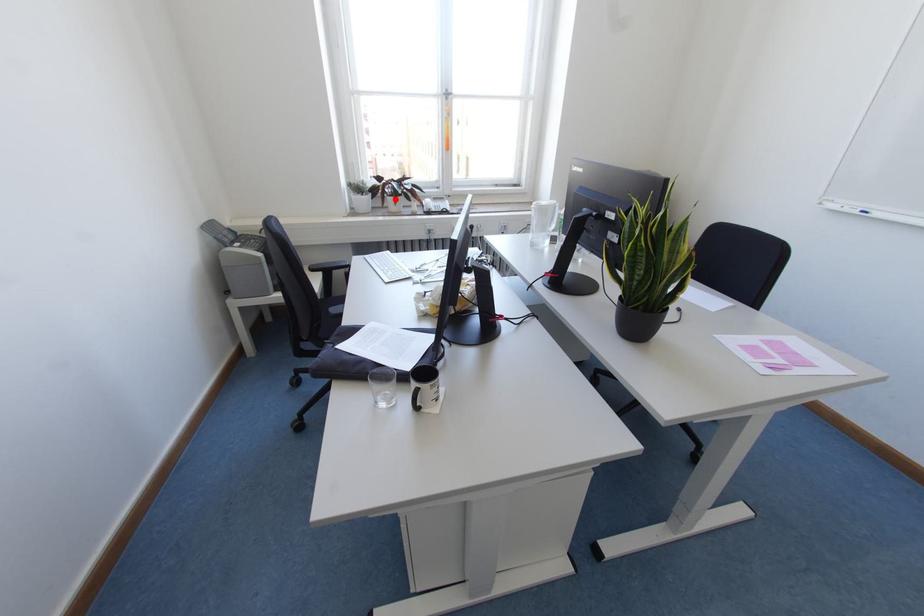
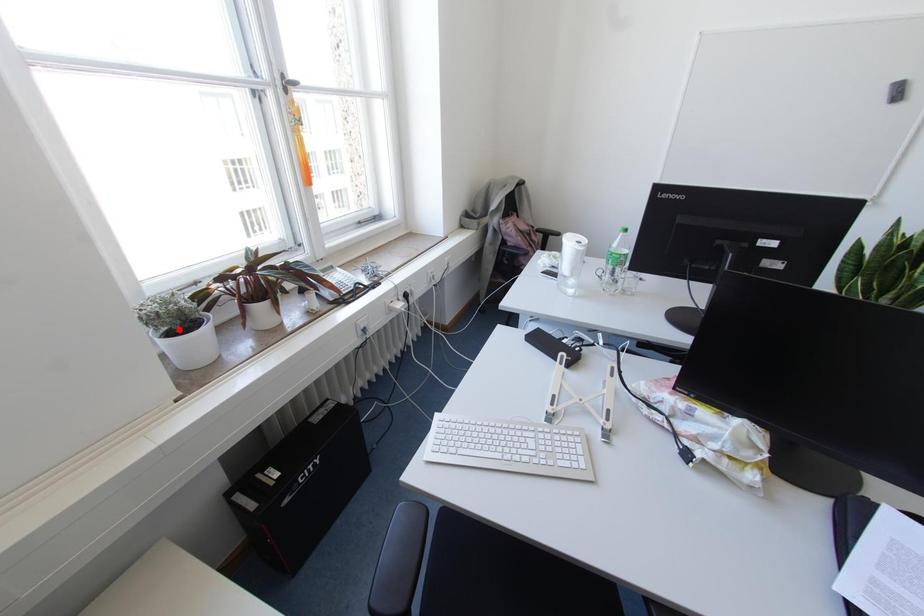
I am providing you with two images of the same scene from different viewpoints. A red point is marked on the first image and another point is marked on the second image. Is the marked point in image1 the same physical position as the marked point in image2?

No